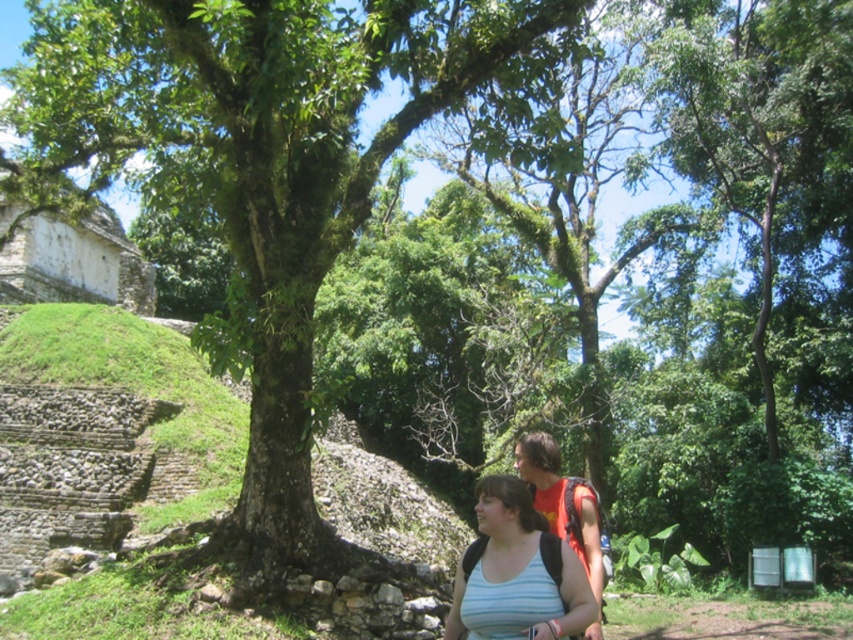
You are a photographer trying to capture the green leafy tree at center and the light blue striped tank top at center in the same frame. Which object will appear larger in the photo?

The green leafy tree at center will appear larger in the photo because it has a greater height compared to the light blue striped tank top at center.

You are standing at the point labeled point (20, 291) and want to take a photo of the point labeled point (482, 604) without any obstructions. Based on the scene description, will the large tree block your view?

Point (482, 604) is in front of point (20, 291), so the large tree will block your view of point (482, 604) from point (20, 291).

You are a photographer wanting to capture both the green leafy tree at center and the white stone amphitheater at upper left in a single frame. Based on their positions, which object should you position closer to the left side of your camera viewfinder?

The white stone amphitheater at upper left should be positioned closer to the left side of your camera viewfinder since the green leafy tree at center is to the right of it.